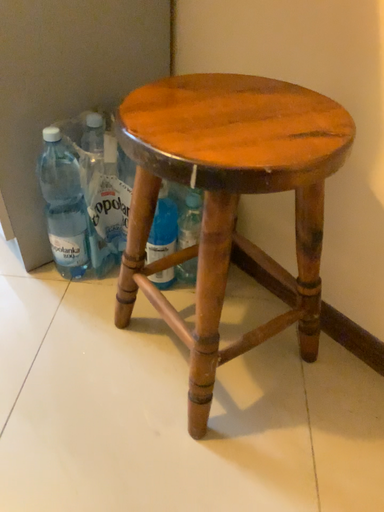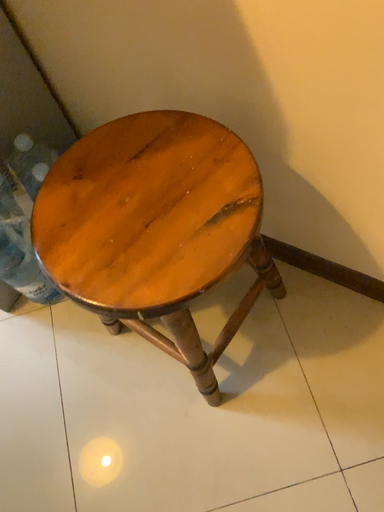
Question: Which way did the camera rotate in the video?

Choices:
 (A) rotated left
 (B) rotated right

Answer: (B)